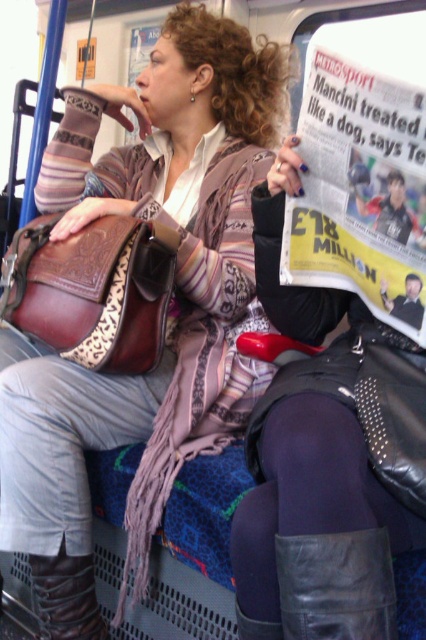
Question: Which point is closer to the camera taking this photo?

Choices:
 (A) (57, 570)
 (B) (363, 612)

Answer: (B)

Question: Does leather bag at center have a greater width compared to leather boot at lower center?

Choices:
 (A) no
 (B) yes

Answer: (B)

Question: Does leather bag at center have a larger size compared to leather boot at lower center?

Choices:
 (A) yes
 (B) no

Answer: (A)

Question: Can you confirm if leather boot at lower center is bigger than leather boot at lower left?

Choices:
 (A) no
 (B) yes

Answer: (A)

Question: Considering the real-world distances, which object is farthest from the leather boot at lower left?

Choices:
 (A) leather boot at lower center
 (B) leather bag at center

Answer: (A)

Question: Which point is farther to the camera?

Choices:
 (A) (380, 538)
 (B) (178, 340)
 (C) (89, 568)

Answer: (B)